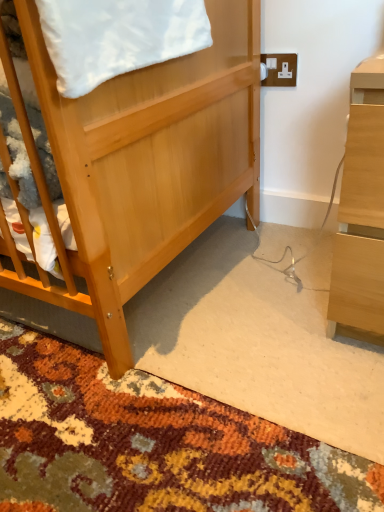
Question: Considering the relative positions of white plastic electric outlet at upper right and light wood desk at right in the image provided, is white plastic electric outlet at upper right to the left of light wood desk at right from the viewer's perspective?

Choices:
 (A) no
 (B) yes

Answer: (B)

Question: Would you say light wood desk at right is part of white plastic electric outlet at upper right's contents?

Choices:
 (A) yes
 (B) no

Answer: (B)

Question: Does white plastic electric outlet at upper right have a greater height compared to light wood desk at right?

Choices:
 (A) no
 (B) yes

Answer: (A)

Question: Can you confirm if white plastic electric outlet at upper right is smaller than light wood desk at right?

Choices:
 (A) yes
 (B) no

Answer: (A)

Question: From a real-world perspective, does white plastic electric outlet at upper right stand above light wood desk at right?

Choices:
 (A) yes
 (B) no

Answer: (A)

Question: From the image's perspective, is light brown wooden bed at center positioned above or below carpeted rug at center?

Choices:
 (A) above
 (B) below

Answer: (A)

Question: From a real-world perspective, is light brown wooden bed at center physically located above or below carpeted rug at center?

Choices:
 (A) above
 (B) below

Answer: (A)

Question: Considering their positions, is light brown wooden bed at center located in front of or behind carpeted rug at center?

Choices:
 (A) behind
 (B) front

Answer: (A)

Question: Considering the positions of light brown wooden bed at center and carpeted rug at center in the image, is light brown wooden bed at center bigger or smaller than carpeted rug at center?

Choices:
 (A) small
 (B) big

Answer: (B)

Question: Looking at the image, does light brown wooden bed at center seem bigger or smaller compared to light wood desk at right?

Choices:
 (A) big
 (B) small

Answer: (A)

Question: Considering their positions, is light brown wooden bed at center located in front of or behind light wood desk at right?

Choices:
 (A) front
 (B) behind

Answer: (A)

Question: Visually, is light brown wooden bed at center positioned to the left or to the right of light wood desk at right?

Choices:
 (A) left
 (B) right

Answer: (A)

Question: Considering the positions of light brown wooden bed at center and light wood desk at right in the image, is light brown wooden bed at center taller or shorter than light wood desk at right?

Choices:
 (A) tall
 (B) short

Answer: (A)

Question: Is light wood desk at right in front of or behind white plastic electric outlet at upper right in the image?

Choices:
 (A) behind
 (B) front

Answer: (B)

Question: From the image's perspective, is light wood desk at right located above or below white plastic electric outlet at upper right?

Choices:
 (A) above
 (B) below

Answer: (B)